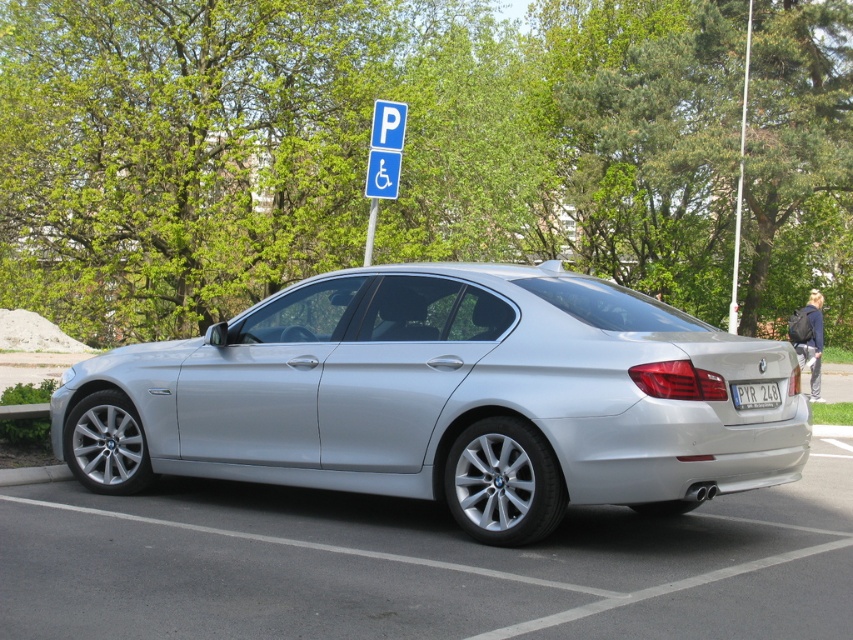
Which of these two, satin silver car at center or white plastic license plate at rear, stands taller?

satin silver car at center is taller.

I want to click on satin silver car at center, so click(445, 397).

The height and width of the screenshot is (640, 853). In order to click on satin silver car at center in this screenshot , I will do `click(445, 397)`.

Does point (106, 516) come in front of point (759, 390)?

No, it is not.

Can you confirm if silver metallic car at center is positioned to the left of white plastic license plate at rear?

Correct, you'll find silver metallic car at center to the left of white plastic license plate at rear.

Who is more forward, (306, 540) or (741, 388)?

Point (741, 388)

Locate an element on the screen. This screenshot has height=640, width=853. silver metallic car at center is located at coordinates [x=419, y=564].

Does point (337, 337) lie behind point (164, 499)?

No.

Locate an element on the screen. This screenshot has height=640, width=853. satin silver car at center is located at coordinates (445, 397).

Find the location of `satin silver car at center`. satin silver car at center is located at coordinates (445, 397).